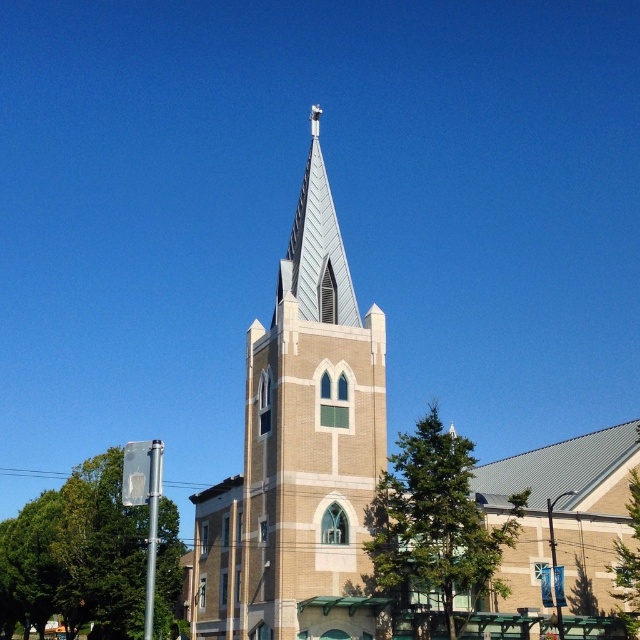
In the scene shown: Between brown brick church steeple at center and metallic silver spire at upper center, which one appears on the left side from the viewer's perspective?

metallic silver spire at upper center

Locate an element on the screen. Image resolution: width=640 pixels, height=640 pixels. brown brick church steeple at center is located at coordinates (x=300, y=452).

The image size is (640, 640). I want to click on brown brick church steeple at center, so click(300, 452).

Looking at this image, which is more to the right, brown brick church steeple at center or white textured steeple at center?

From the viewer's perspective, brown brick church steeple at center appears more on the right side.

Does brown brick church steeple at center have a greater width compared to white textured steeple at center?

Yes.

Where is `brown brick church steeple at center`? brown brick church steeple at center is located at coordinates (300, 452).

Locate an element on the screen. This screenshot has width=640, height=640. white textured steeple at center is located at coordinates [300, 452].

Between point (321, 237) and point (323, 301), which one is positioned in front?

Point (323, 301)

Identify the location of white textured steeple at center. Image resolution: width=640 pixels, height=640 pixels. (300, 452).